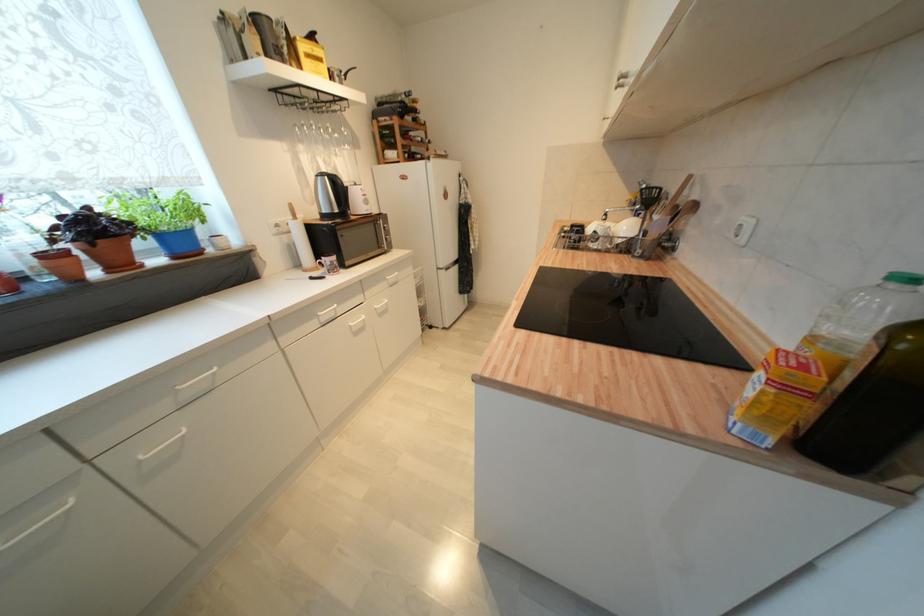
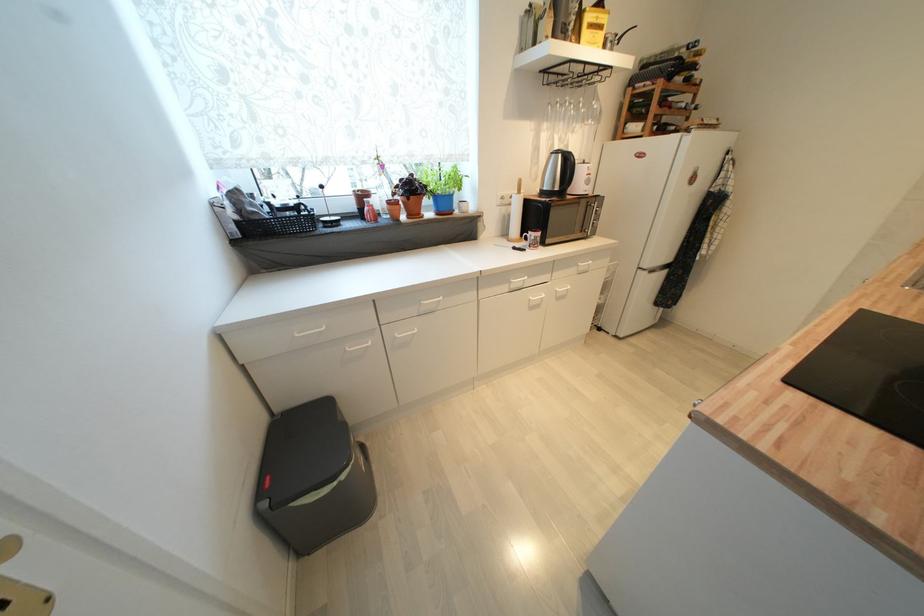
Where in the second image is the point corresponding to (x=383, y=301) from the first image?

(566, 285)